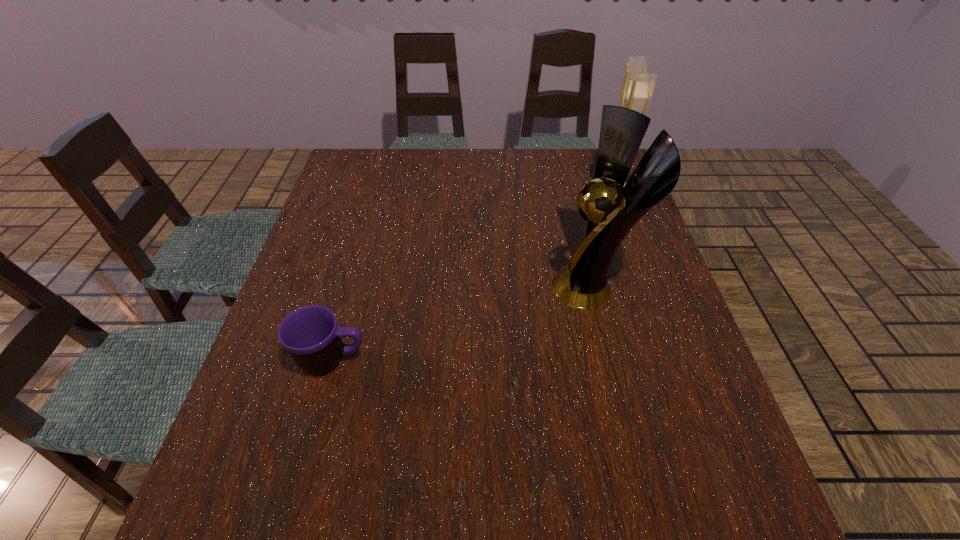
Locate an element on the screen. This screenshot has width=960, height=540. blank space located 0.060m with the handle on the side of the leftmost object is located at coordinates (397, 360).

Locate an element on the screen. object at the far edge is located at coordinates (637, 88).

I want to click on object located at the left edge, so click(311, 335).

You are a GUI agent. You are given a task and a screenshot of the screen. Output one action in this format:
    pyautogui.click(x=<x>, y=<y>)
    Task: Click on the object located at the far right corner
    The height and width of the screenshot is (540, 960).
    Given the screenshot: What is the action you would take?
    pyautogui.click(x=637, y=88)

Image resolution: width=960 pixels, height=540 pixels. In order to click on vacant space at the far edge of the desktop in this screenshot , I will do `click(522, 158)`.

Where is `vacant space at the left edge`? The height and width of the screenshot is (540, 960). vacant space at the left edge is located at coordinates (349, 299).

Locate an element on the screen. This screenshot has width=960, height=540. vacant space at the right edge of the desktop is located at coordinates (656, 292).

The width and height of the screenshot is (960, 540). Find the location of `vacant position at the far left corner of the desktop`. vacant position at the far left corner of the desktop is located at coordinates (353, 150).

What are the coordinates of `vacant area at the far right corner` in the screenshot? It's located at (595, 148).

I want to click on unoccupied position between the nearest object and the farther award, so click(x=471, y=276).